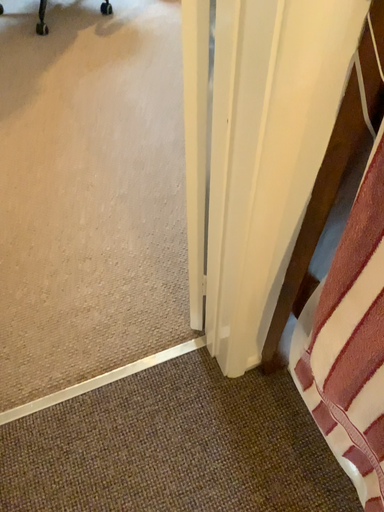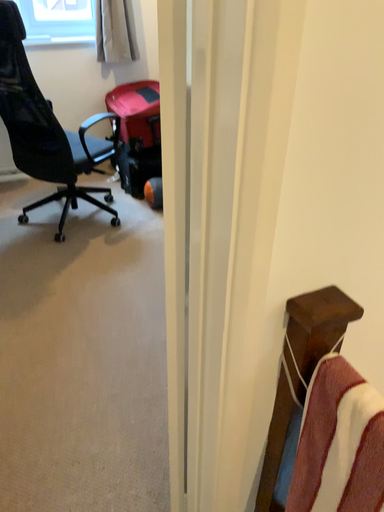
Question: How did the camera likely rotate when shooting the video?

Choices:
 (A) rotated upward
 (B) rotated downward

Answer: (A)